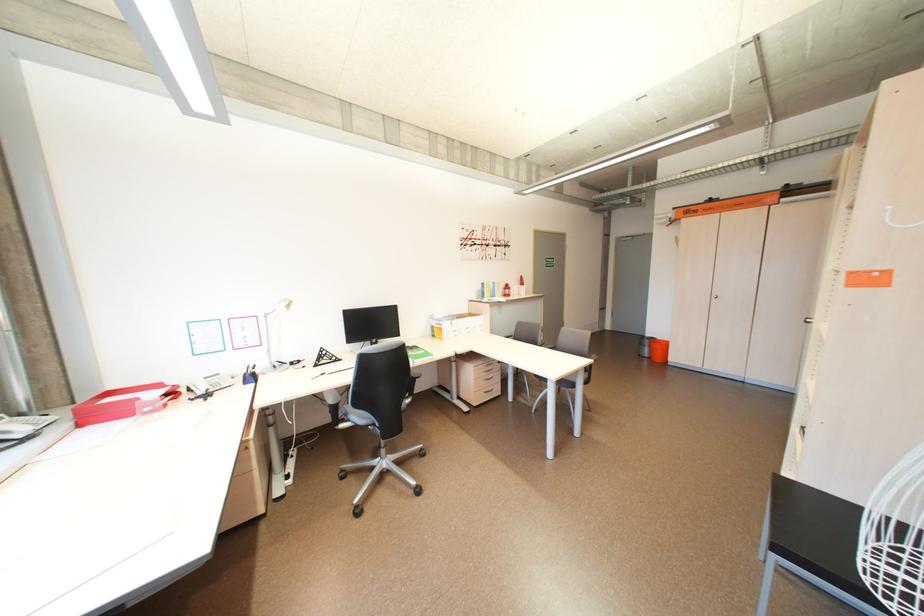
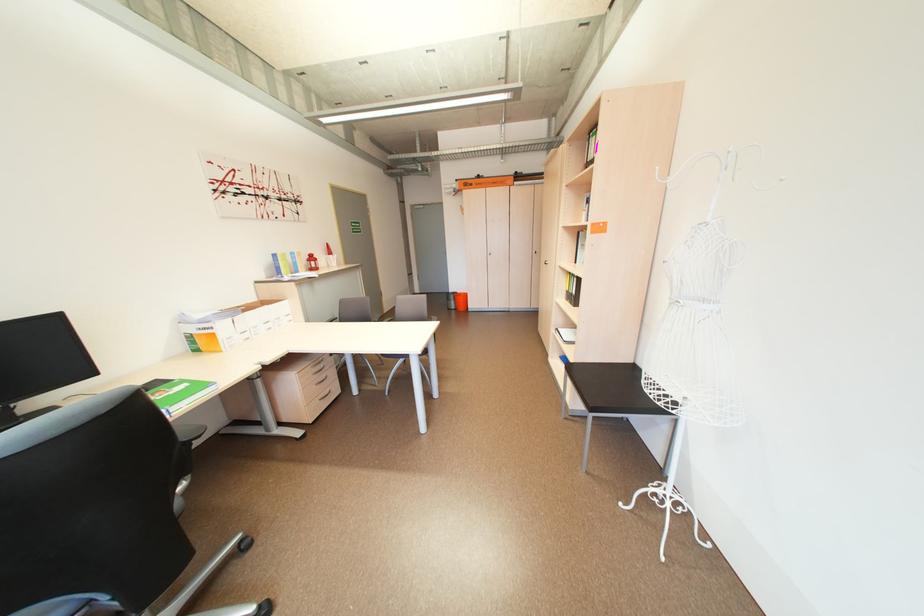
Question: How did the camera likely rotate?

Choices:
 (A) Left
 (B) Right
 (C) Up
 (D) Down

Answer: (B)